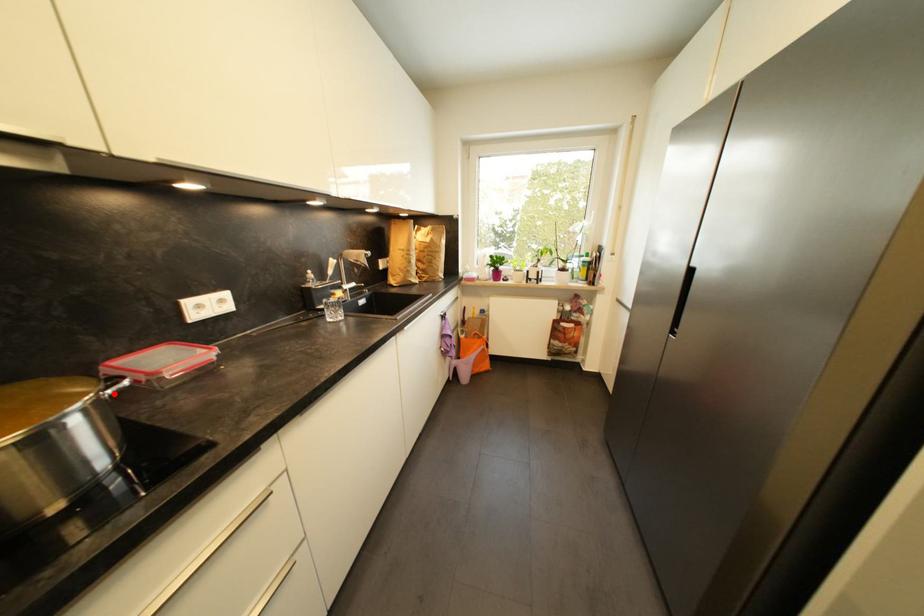
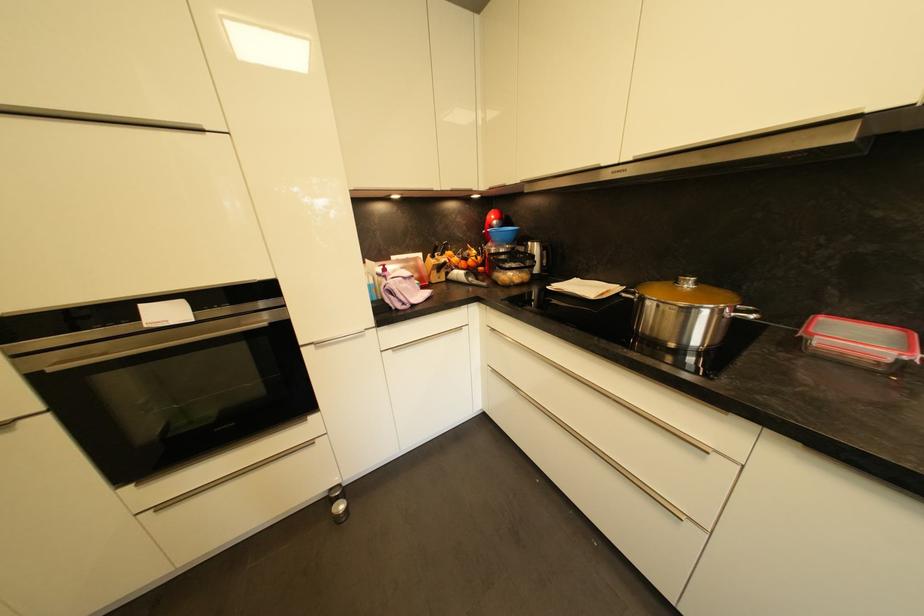
In the second image, find the point that corresponds to the highlighted location in the first image.

(737, 315)